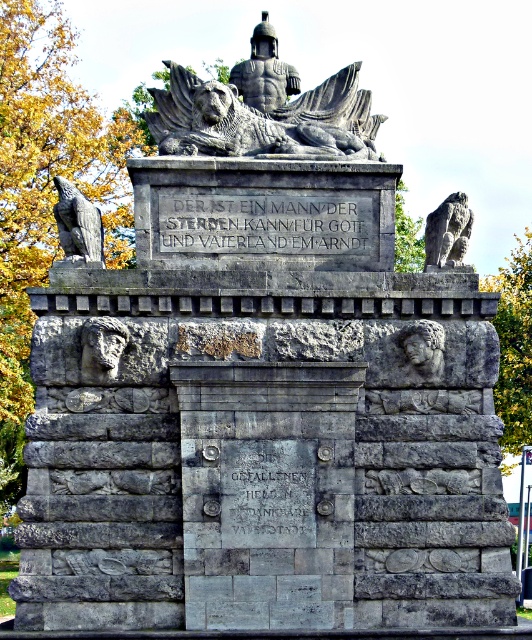
structural integrity of the monument is compromised if any part is removed. The gray stone inscription at center is located at point (266, 225). If a restoration team plans to remove the gray stone inscription at center to clean it, will this action endanger the structural integrity of the monument?

structural integrity of the monument is compromised if any part is removed. The gray stone inscription at center is located at point (266, 225). Since the inscription is part of the monument, removing it would compromise structural integrity. Therefore, removing the gray stone inscription at center would endanger the monument.

You are a historian examining the monument. You notice the gray stone inscription at center and the gray stone eagle at upper left. Which object has a greater height?

The gray stone eagle at upper left is taller than the gray stone inscription at center, so the eagle has a greater height.

What is the spatial relationship between the gray stone inscription at center and the gray stone eagle at upper left on the monument?

The gray stone inscription at center is located to the right of the gray stone eagle at upper left.